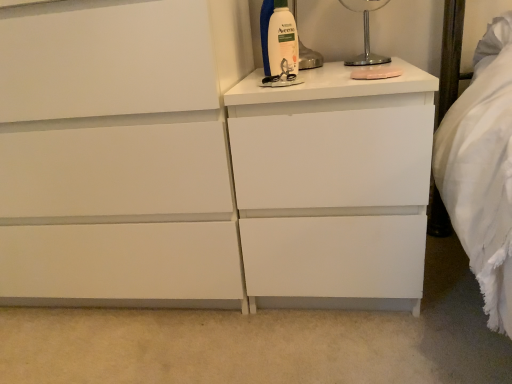
Question: Can you confirm if metallic silver lamp at upper right is bigger than white matte chest of drawers at center?

Choices:
 (A) yes
 (B) no

Answer: (B)

Question: From a real-world perspective, does metallic silver lamp at upper right stand above white matte chest of drawers at center?

Choices:
 (A) no
 (B) yes

Answer: (B)

Question: Is white matte chest of drawers at center completely or partially inside metallic silver lamp at upper right?

Choices:
 (A) no
 (B) yes

Answer: (A)

Question: From a real-world perspective, is metallic silver lamp at upper right beneath white matte chest of drawers at center?

Choices:
 (A) yes
 (B) no

Answer: (B)

Question: Is metallic silver lamp at upper right wider than white matte chest of drawers at center?

Choices:
 (A) yes
 (B) no

Answer: (B)

Question: Considering the relative sizes of metallic silver lamp at upper right and white matte chest of drawers at center in the image provided, is metallic silver lamp at upper right smaller than white matte chest of drawers at center?

Choices:
 (A) no
 (B) yes

Answer: (B)

Question: From the image's perspective, is white plastic bottle at upper right above white matte nightstand at center?

Choices:
 (A) yes
 (B) no

Answer: (A)

Question: From the image's perspective, would you say white plastic bottle at upper right is shown under white matte nightstand at center?

Choices:
 (A) no
 (B) yes

Answer: (A)

Question: Is white plastic bottle at upper right positioned beyond the bounds of white matte nightstand at center?

Choices:
 (A) no
 (B) yes

Answer: (B)

Question: Can you confirm if white plastic bottle at upper right is thinner than white matte nightstand at center?

Choices:
 (A) yes
 (B) no

Answer: (A)

Question: Considering the relative positions of white plastic bottle at upper right and white matte nightstand at center in the image provided, is white plastic bottle at upper right to the right of white matte nightstand at center from the viewer's perspective?

Choices:
 (A) yes
 (B) no

Answer: (B)

Question: Is white plastic bottle at upper right aimed at white matte nightstand at center?

Choices:
 (A) no
 (B) yes

Answer: (A)

Question: Would you say white matte chest of drawers at center is outside metallic silver lamp at upper right?

Choices:
 (A) yes
 (B) no

Answer: (A)